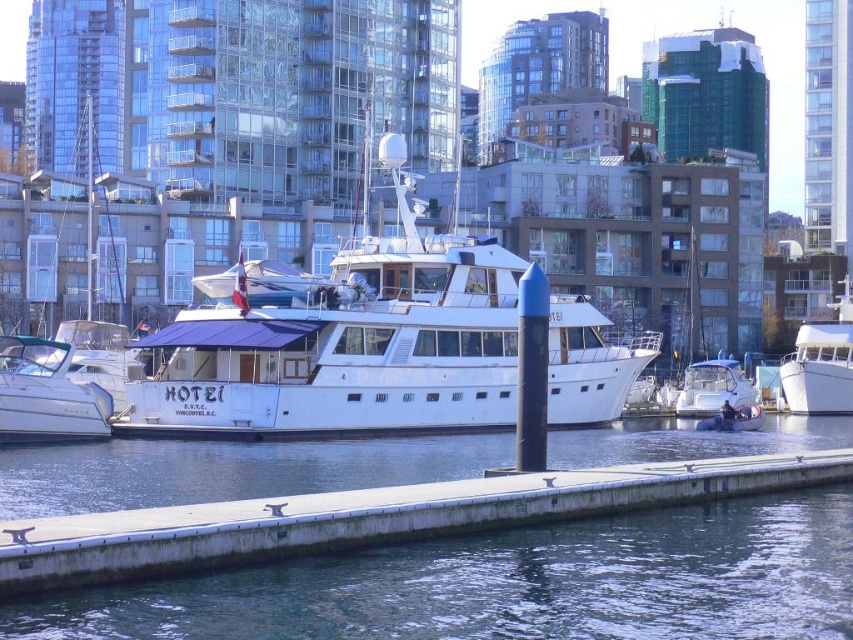
Question: Which object is closer to the camera taking this photo?

Choices:
 (A) white matte boat at center
 (B) clear water at dock center

Answer: (B)

Question: Is clear water at dock center bigger than white glossy boat at right?

Choices:
 (A) no
 (B) yes

Answer: (A)

Question: Which object appears farthest from the camera in this image?

Choices:
 (A) white matte boat at center
 (B) white glossy motorboat at lower left

Answer: (B)

Question: Which point is farther to the camera?

Choices:
 (A) (154, 632)
 (B) (36, 360)
 (C) (699, 381)

Answer: (C)

Question: Does white matte boat at center appear on the left side of white glossy boat at right?

Choices:
 (A) no
 (B) yes

Answer: (B)

Question: Does white matte boat at center have a lesser width compared to white glossy motorboat at lower right?

Choices:
 (A) no
 (B) yes

Answer: (A)